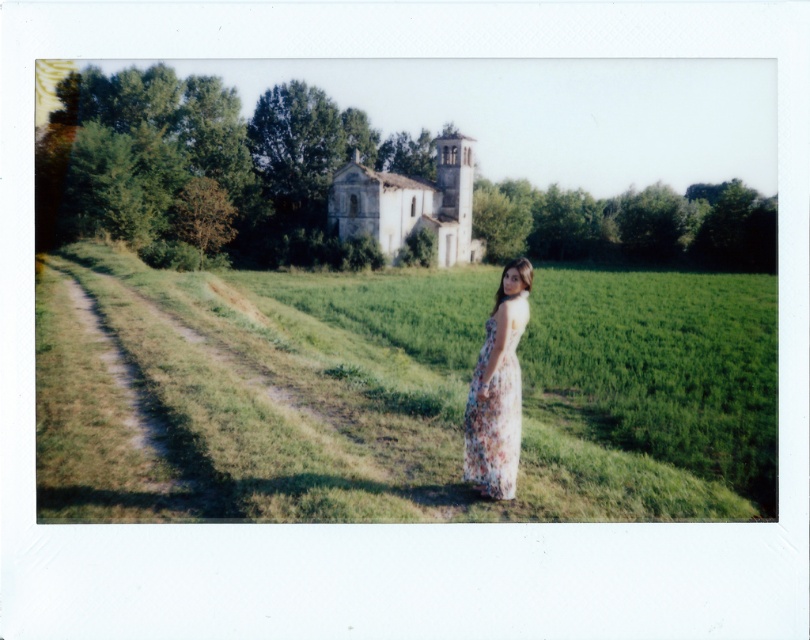
The height and width of the screenshot is (640, 810). What do you see at coordinates (399, 394) in the screenshot?
I see `green grass at center` at bounding box center [399, 394].

Can you confirm if green grass at center is smaller than floral cotton dress at center?

Actually, green grass at center might be larger than floral cotton dress at center.

What do you see at coordinates (399, 394) in the screenshot? This screenshot has height=640, width=810. I see `green grass at center` at bounding box center [399, 394].

What are the coordinates of `green grass at center` in the screenshot? It's located at (399, 394).